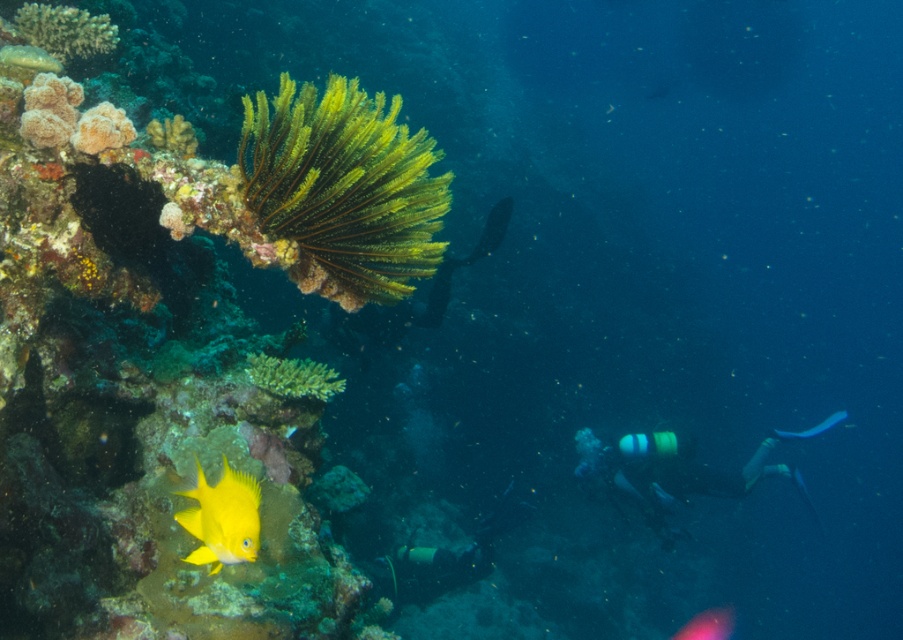
You are a scuba diver observing the underwater scene. You notice two points marked in the image. The first point is at coordinate point (70, 540) and the second is at point (815, 428). Which point is closer to you as you look at the image?

Point (70, 540) is in front of point (815, 428), so it is closer to you.

You are a marine biologist observing this underwater scene. You notice the green matte coral at upper left and the yellow matte fish at lower left. Which object is positioned closer to your viewpoint?

The green matte coral at upper left is closer to the viewer than the yellow matte fish at lower left.

You are a scuba diver who wants to take a photo of the blue rubber tube at right without the yellow coral reef at lower left appearing in the background. Is this possible given their positions?

The yellow coral reef at lower left is closer to the viewer than the blue rubber tube at right, so it would block the blue rubber tube at right from view. Therefore, it is not possible to take a photo of the blue rubber tube at right without the yellow coral reef at lower left appearing in the background.